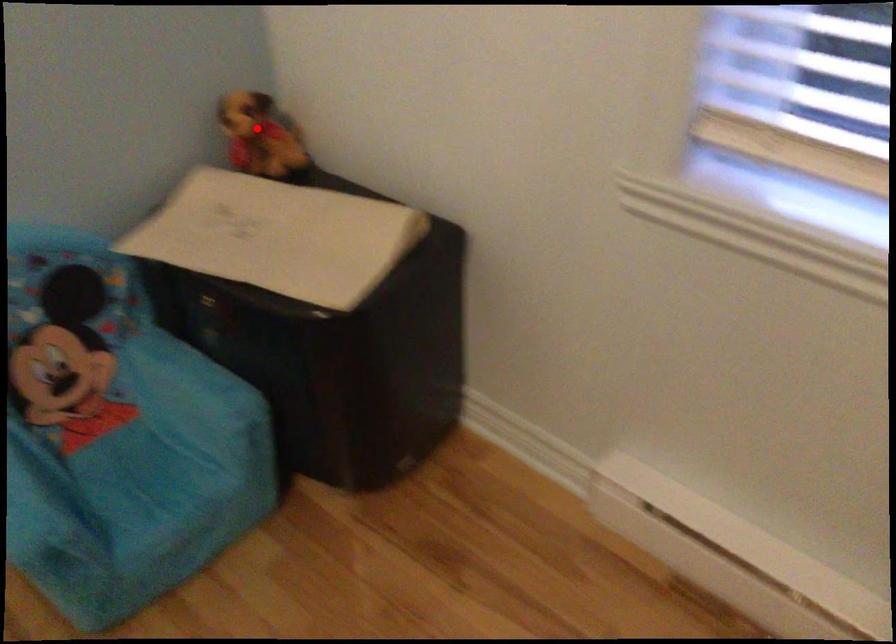
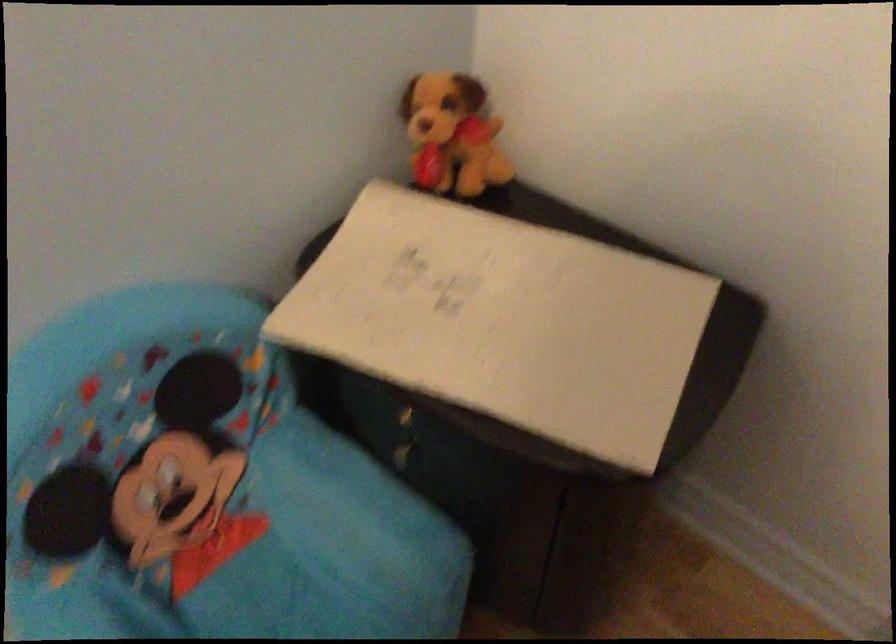
Question: I am providing you with two images of the same scene from different viewpoints. In image1, a red point is highlighted. Considering the same 3D point in image2, which of the following is correct?

Choices:
 (A) It is closer
 (B) It is farther

Answer: (A)